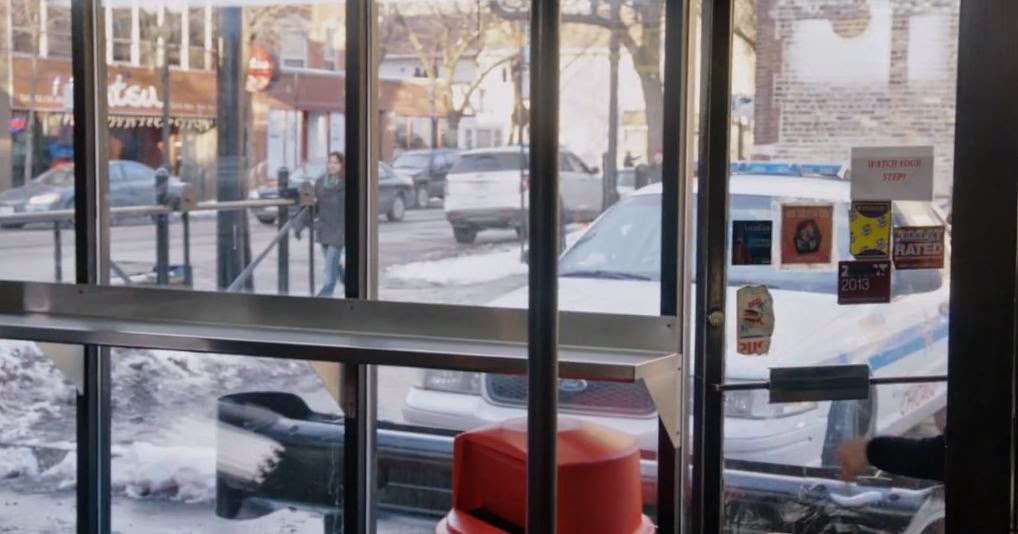
You are a GUI agent. You are given a task and a screenshot of the screen. Output one action in this format:
    pyautogui.click(x=<x>, y=<y>)
    Task: Click on the door handle
    The width and height of the screenshot is (1018, 534).
    Given the screenshot: What is the action you would take?
    pyautogui.click(x=830, y=379)